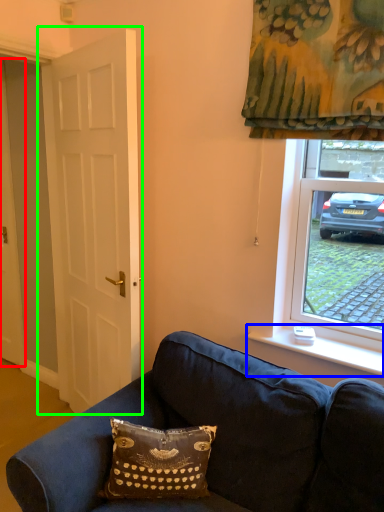
Question: Which object is positioned farthest from door (highlighted by a red box)? Select from window sill (highlighted by a blue box) and door (highlighted by a green box).

Choices:
 (A) window sill
 (B) door

Answer: (A)